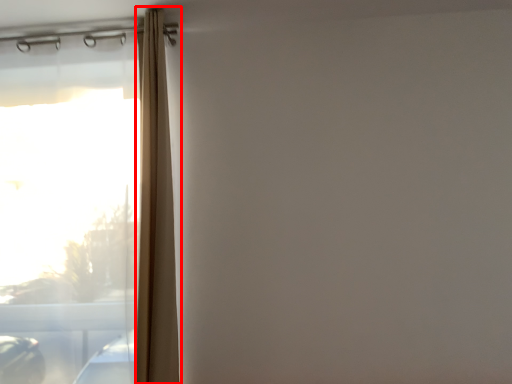
Question: Considering the relative positions of shower curtain (annotated by the red box) and window in the image provided, where is shower curtain (annotated by the red box) located with respect to the staircase?

Choices:
 (A) right
 (B) left

Answer: (A)